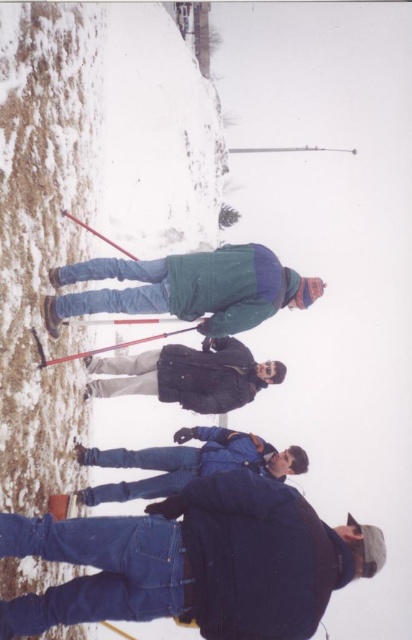
Can you confirm if green matte jacket at center is taller than red plastic ski pole at center?

Yes, green matte jacket at center is taller than red plastic ski pole at center.

Where is `green matte jacket at center`? Image resolution: width=412 pixels, height=640 pixels. green matte jacket at center is located at coordinates (187, 289).

Who is more forward, [252,298] or [257,371]?

Point [252,298] is in front.

The image size is (412, 640). What do you see at coordinates (187, 289) in the screenshot?
I see `green matte jacket at center` at bounding box center [187, 289].

Is point (198, 285) closer to viewer compared to point (103, 384)?

Yes, point (198, 285) is in front of point (103, 384).

Where is `green matte jacket at center`? The height and width of the screenshot is (640, 412). green matte jacket at center is located at coordinates (187, 289).

Which is below, dark gray jacket at center or red plastic ski pole at center?

Positioned lower is dark gray jacket at center.

Does point (180, 400) come closer to viewer compared to point (48, 364)?

That is False.

The image size is (412, 640). What do you see at coordinates (187, 376) in the screenshot? I see `dark gray jacket at center` at bounding box center [187, 376].

You are a GUI agent. You are given a task and a screenshot of the screen. Output one action in this format:
    pyautogui.click(x=<x>, y=<y>)
    Task: Click on the dark gray jacket at center
    Image resolution: width=412 pixels, height=640 pixels.
    Given the screenshot: What is the action you would take?
    pyautogui.click(x=187, y=376)